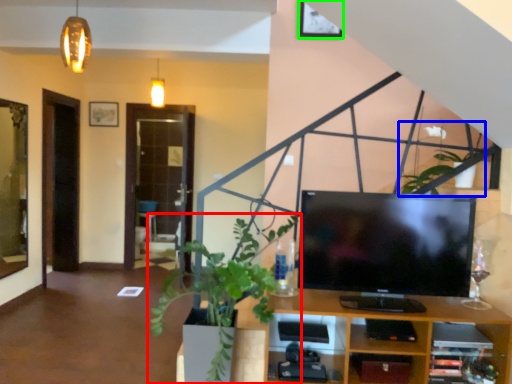
Question: Which object is the closest to the houseplant (highlighted by a red box)? Choose among these: plant (highlighted by a blue box) or picture frame (highlighted by a green box).

Choices:
 (A) plant
 (B) picture frame

Answer: (A)